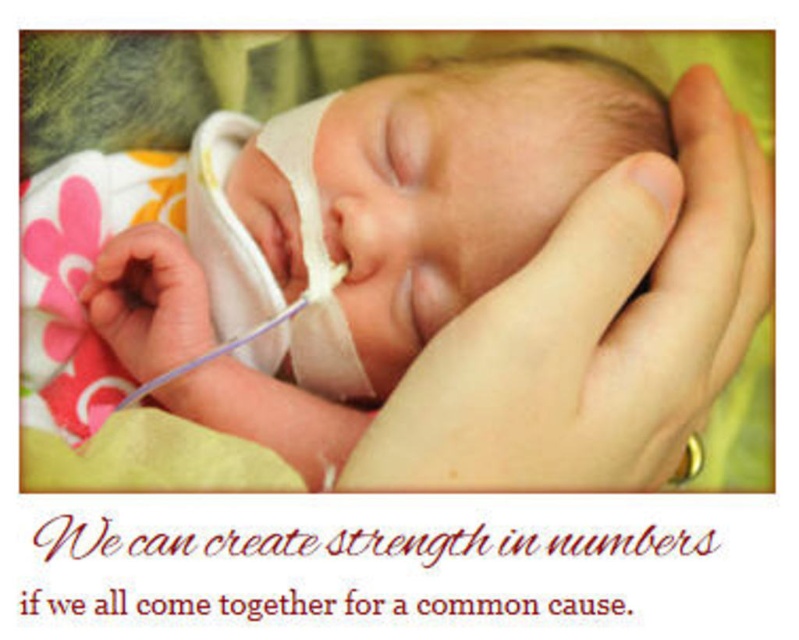
This screenshot has width=799, height=640. What are the coordinates of `smooth skin newborn at center` in the screenshot? It's located at (297, 257).

Can you confirm if smooth skin newborn at center is positioned below rubber teething ring at lower right?

Actually, smooth skin newborn at center is above rubber teething ring at lower right.

What do you see at coordinates (297, 257) in the screenshot?
I see `smooth skin newborn at center` at bounding box center [297, 257].

Where is `smooth skin newborn at center`? The height and width of the screenshot is (640, 799). smooth skin newborn at center is located at coordinates (297, 257).

Does smooth skin newborn at center appear under smooth skin hand at center?

No, smooth skin newborn at center is not below smooth skin hand at center.

Does point (305, 275) come in front of point (635, 408)?

No, (305, 275) is further to viewer.

The image size is (799, 640). In order to click on smooth skin newborn at center in this screenshot , I will do `click(297, 257)`.

Is smooth skin hand at center shorter than rubber teething ring at lower right?

No.

Based on the photo, does smooth skin hand at center appear over rubber teething ring at lower right?

Yes, smooth skin hand at center is above rubber teething ring at lower right.

This screenshot has width=799, height=640. I want to click on smooth skin hand at center, so click(594, 330).